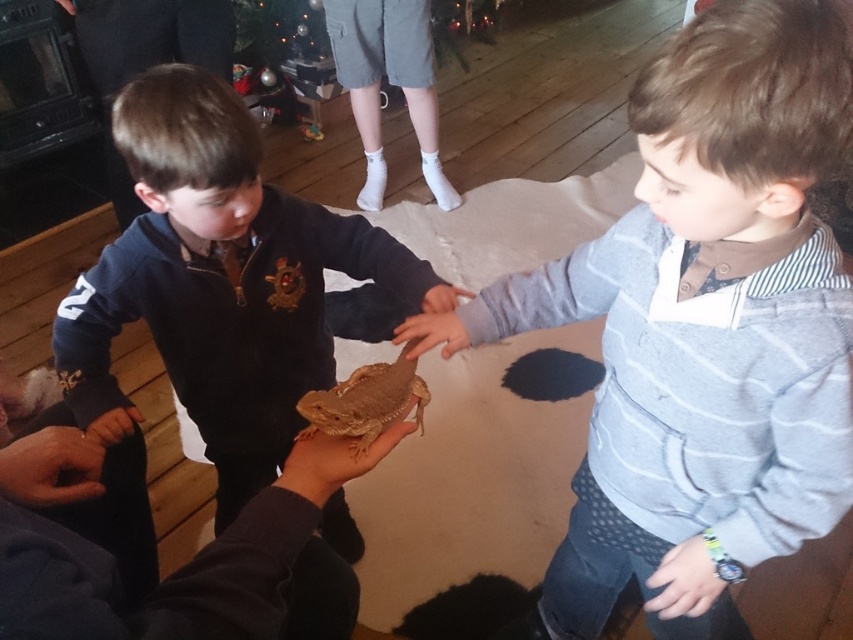
You are a guest at the gathering and want to touch the reptile. The host says you can only touch the object that is smaller between the matte brown sweater at center and the smooth brown hand at center. Which one should you choose?

The smooth brown hand at center is smaller than the matte brown sweater at center, so you should choose to touch the smooth brown hand at center.

You are a guest at this event and want to pet the brown scaly lizard at center. The host tells you that the smooth brown hand at center belongs to the boy holding the lizard. Which direction should you move your hand relative to the lizard to avoid touching the boy?

The brown scaly lizard at center is positioned on the left side of the smooth brown hand at center. To avoid touching the boy, you should move your hand to the right side of the lizard.